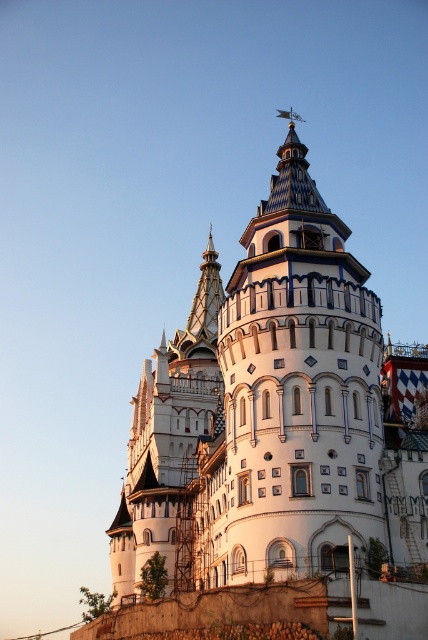
Question: Can you confirm if white ceramic tower at center is positioned to the right of white stone tower at center?

Choices:
 (A) no
 (B) yes

Answer: (B)

Question: Can you confirm if white ceramic tower at center is positioned above white stone tower at center?

Choices:
 (A) no
 (B) yes

Answer: (B)

Question: Among these objects, which one is farthest from the camera?

Choices:
 (A) white ceramic tower at center
 (B) white stone tower at center

Answer: (B)

Question: Among these objects, which one is nearest to the camera?

Choices:
 (A) white ceramic tower at center
 (B) white stone tower at center

Answer: (A)

Question: Is white ceramic tower at center below white stone tower at center?

Choices:
 (A) no
 (B) yes

Answer: (A)

Question: Which point is farther from the camera taking this photo?

Choices:
 (A) (246, 440)
 (B) (178, 531)

Answer: (B)